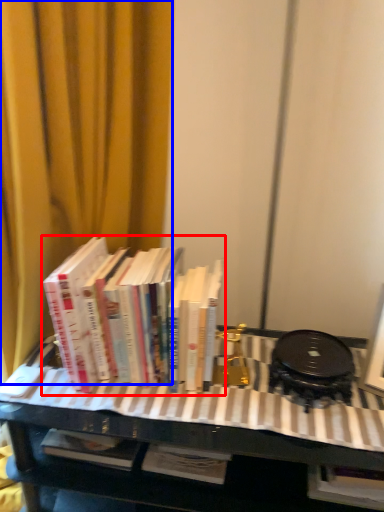
Question: Which object is closer to the camera taking this photo, book (highlighted by a red box) or curtain (highlighted by a blue box)?

Choices:
 (A) book
 (B) curtain

Answer: (B)